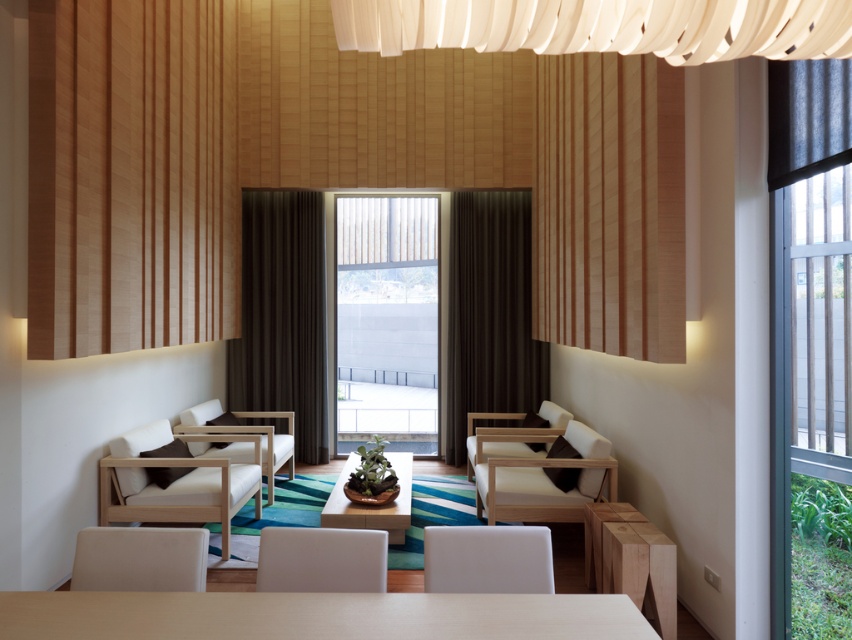
Question: Can you confirm if white fabric chandelier at upper center is thinner than dark brown fabric curtain at left?

Choices:
 (A) yes
 (B) no

Answer: (A)

Question: Estimate the real-world distances between objects in this image. Which object is closer to the wooden slats at upper center?

Choices:
 (A) white fabric armchair at center
 (B) wooden bowl at center
 (C) dark brown fabric curtain at left
 (D) light wood table at lower center

Answer: (A)

Question: Which of the following is the farthest from the observer?

Choices:
 (A) white wood chair at center
 (B) light brown wood chair at center
 (C) dark brown fabric curtain at left

Answer: (C)

Question: Does wooden paneling at left appear on the right side of white leather armchair at center?

Choices:
 (A) yes
 (B) no

Answer: (B)

Question: Estimate the real-world distances between objects in this image. Which object is closer to the white matte armchair at lower center?

Choices:
 (A) beige fabric chair at lower left
 (B) metallic glass window at right

Answer: (A)

Question: Does clear glass window at center appear on the right side of light brown wood chair at center?

Choices:
 (A) yes
 (B) no

Answer: (B)